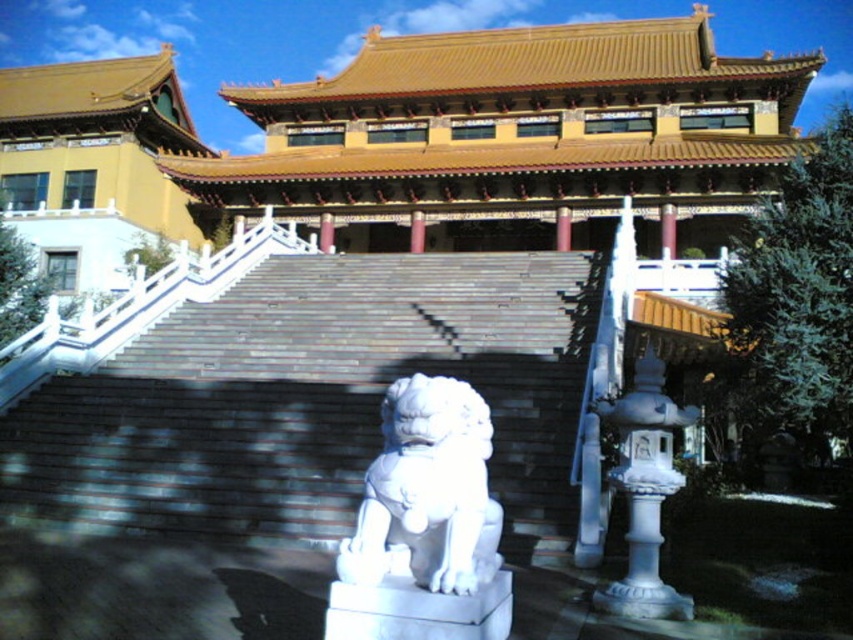
Question: Which of the following is the farthest from the observer?

Choices:
 (A) (358, 564)
 (B) (323, 467)

Answer: (B)

Question: Can you confirm if white stone stairs at center is positioned to the left of white stone lion at center?

Choices:
 (A) no
 (B) yes

Answer: (B)

Question: Does white stone stairs at center have a larger size compared to white stone lion at center?

Choices:
 (A) yes
 (B) no

Answer: (A)

Question: Which of the following is the closest to the observer?

Choices:
 (A) (447, 552)
 (B) (532, 340)

Answer: (A)

Question: Is the position of white stone stairs at center less distant than that of white stone lion at center?

Choices:
 (A) no
 (B) yes

Answer: (A)